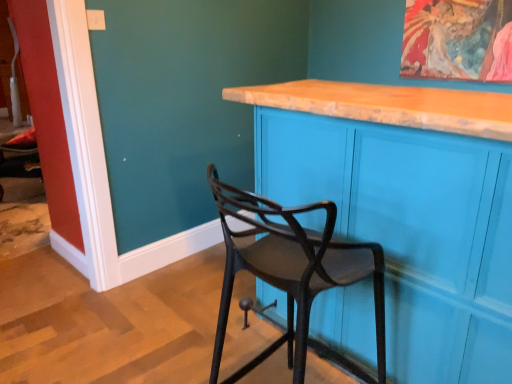
Question: Is matte black chair at center in front of or behind matte blue cabinet at center in the image?

Choices:
 (A) behind
 (B) front

Answer: (B)

Question: Do you think matte black chair at center is within matte blue cabinet at center, or outside of it?

Choices:
 (A) inside
 (B) outside

Answer: (B)

Question: In terms of width, does matte black chair at center look wider or thinner when compared to matte blue cabinet at center?

Choices:
 (A) wide
 (B) thin

Answer: (B)

Question: Is matte blue cabinet at center in front of or behind matte black chair at center in the image?

Choices:
 (A) front
 (B) behind

Answer: (B)

Question: Would you say matte blue cabinet at center is to the left or to the right of matte black chair at center in the picture?

Choices:
 (A) right
 (B) left

Answer: (A)

Question: Would you say matte blue cabinet at center is inside or outside matte black chair at center?

Choices:
 (A) outside
 (B) inside

Answer: (A)

Question: Is point (426, 256) positioned closer to the camera than point (227, 190)?

Choices:
 (A) farther
 (B) closer

Answer: (B)